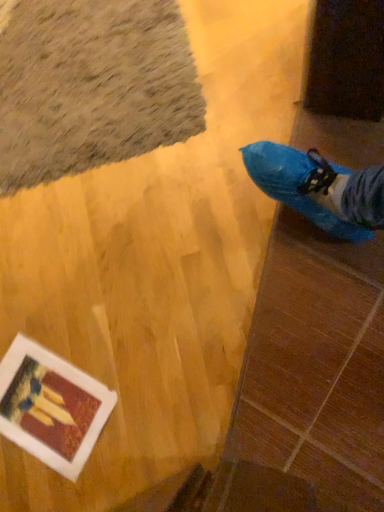
Locate an element on the screen. Image resolution: width=384 pixels, height=512 pixels. free space to the back side of white matte painting at lower left is located at coordinates (33, 301).